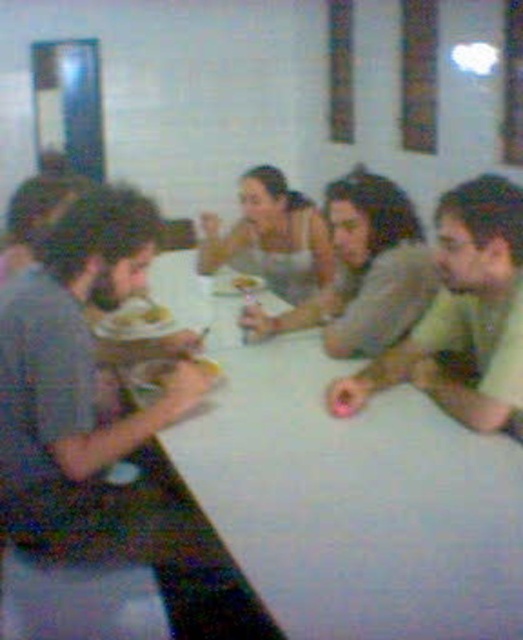
You are a person sitting at the white glossy table at center. You want to reach for the matte gray shirt at left. Is the table surface higher or lower than the shirt?

The white glossy table at center is shorter than the matte gray shirt at left, so the table surface is lower than the shirt.

You are organizing a photo shoot and need to ensure that the green matte shirt at center and the smooth gray sweater at center are visible in the frame. Given their sizes, which one might require more space in the composition?

The green matte shirt at center is bigger than the smooth gray sweater at center, so it might require more space in the composition.